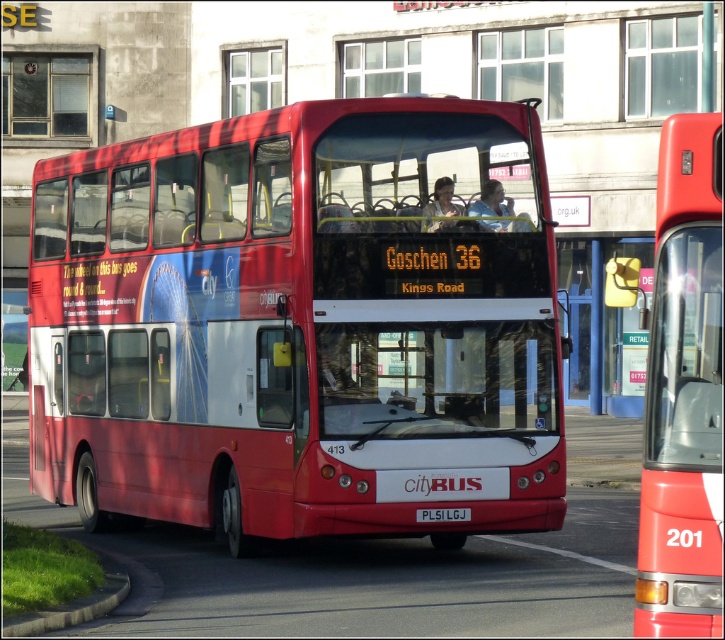
You are a photographer standing in front of the matte red bus at center and the matte plastic face at center. You want to capture both objects in a single wide shot. Which object should you position closer to the camera to ensure both fit in the frame?

The matte red bus at center is thinner than the matte plastic face at center, so positioning the matte plastic face at center closer to the camera would allow both to fit in the frame since it is wider and requires more space.

You are standing in front of the red double decker bus and want to take a photo. You notice two points marked on the bus, one at point (133,385) and the other at point (450,221). Which point is closer to you when you are facing the bus?

Point (133,385) is further to the camera than point (450,221), so the point closer to you is point (450,221).

You are a delivery person who needs to place a small package between the shiny red bus at center and the matte plastic face at center. The package requires a minimum of 8 feet of space to fit. Can you fit the package between them?

The shiny red bus at center and the matte plastic face at center are 7.78 feet apart from each other, which is less than the required 8 feet. Therefore, the package cannot fit between them.